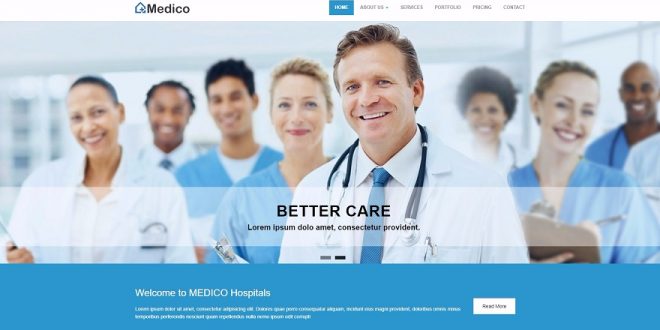
In order to click on window in this screenshot , I will do `click(594, 48)`.